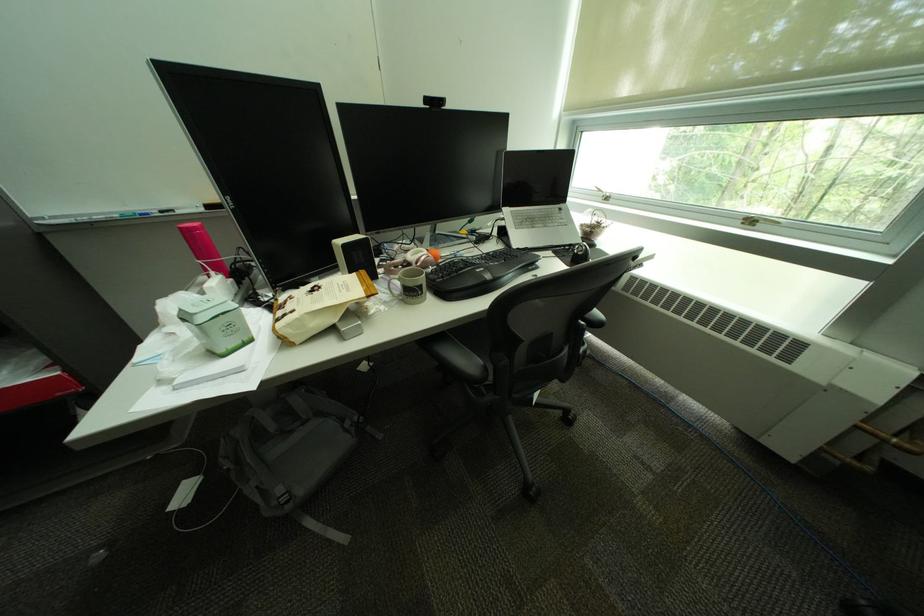
At what (x,y) coordinates should I click in order to perform the action: click on grey mug handle. Please return your answer as a coordinate pair (x, y). The image size is (924, 616). Looking at the image, I should click on (411, 285).